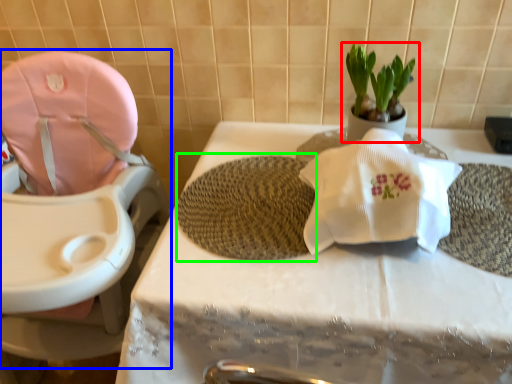
Question: Based on their relative distances, which object is farther from houseplant (highlighted by a red box)? Choose from baby carriage (highlighted by a blue box) and bath mat (highlighted by a green box).

Choices:
 (A) baby carriage
 (B) bath mat

Answer: (A)